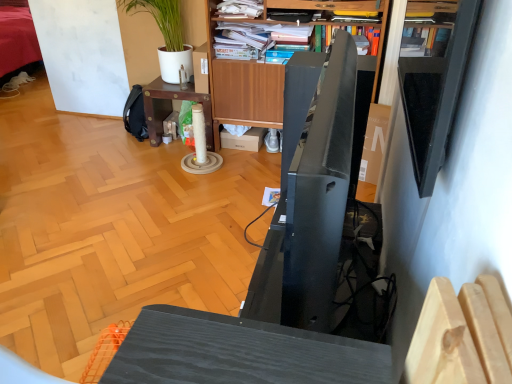
Image resolution: width=512 pixels, height=384 pixels. In order to click on vacant area that is in front of wooden desk at center in this screenshot , I will do pyautogui.click(x=167, y=165).